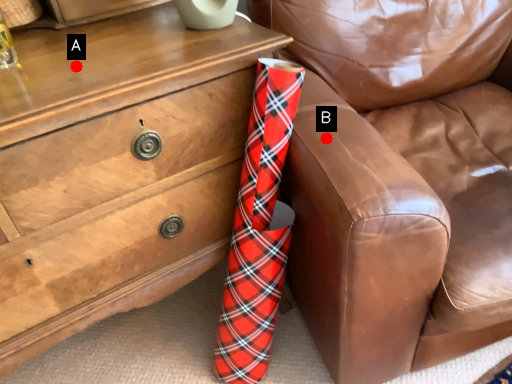
Question: Two points are circled on the image, labeled by A and B beside each circle. Which point is closer to the camera?

Choices:
 (A) A is closer
 (B) B is closer

Answer: (A)